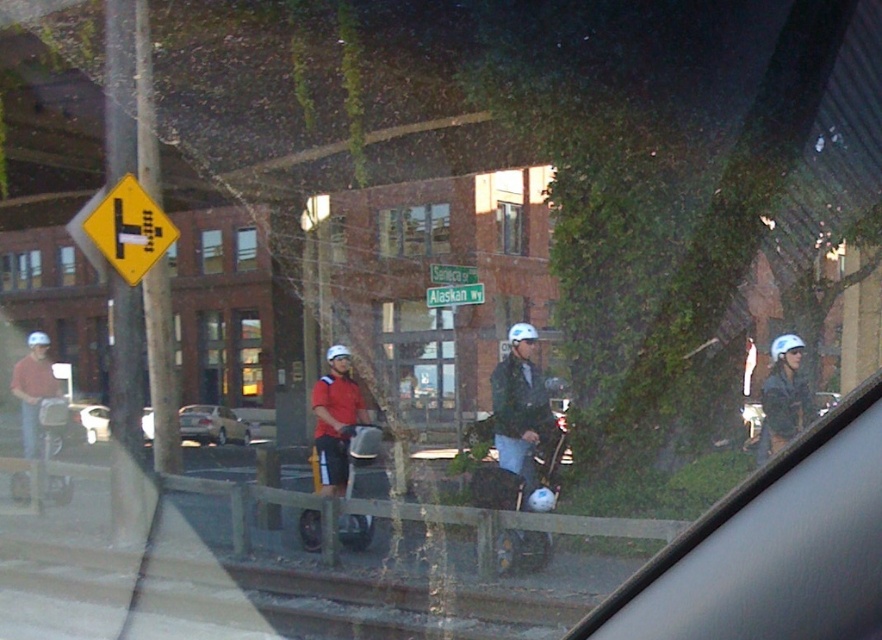
Is yellow plastic traffic sign at upper left bigger than green plastic street sign at center?

Indeed, yellow plastic traffic sign at upper left has a larger size compared to green plastic street sign at center.

At what (x,y) coordinates should I click in order to perform the action: click on yellow plastic traffic sign at upper left. Please return your answer as a coordinate pair (x, y). Looking at the image, I should click on (129, 228).

Is point (129, 189) closer to camera compared to point (453, 298)?

Yes, point (129, 189) is closer to viewer.

The width and height of the screenshot is (882, 640). Find the location of `yellow plastic traffic sign at upper left`. yellow plastic traffic sign at upper left is located at coordinates (129, 228).

Consider the image. Does metallic silver scooter at center come behind green plastic street sign at center?

No, it is in front of green plastic street sign at center.

Does metallic silver scooter at center have a greater width compared to green plastic street sign at center?

Correct, the width of metallic silver scooter at center exceeds that of green plastic street sign at center.

Describe the element at coordinates (360, 449) in the screenshot. I see `metallic silver scooter at center` at that location.

Find the location of a particular element. metallic silver scooter at center is located at coordinates (360, 449).

Consider the image. Can you confirm if matte black helmet at center is wider than metallic silver scooter at center?

In fact, matte black helmet at center might be narrower than metallic silver scooter at center.

Which is in front, point (505, 412) or point (380, 433)?

Point (505, 412) is in front.

Is point (505, 394) less distant than point (365, 541)?

Yes, it is in front of point (365, 541).

You are a GUI agent. You are given a task and a screenshot of the screen. Output one action in this format:
    pyautogui.click(x=<x>, y=<y>)
    Task: Click on the matte black helmet at center
    The image size is (882, 640).
    Given the screenshot: What is the action you would take?
    pyautogui.click(x=519, y=404)